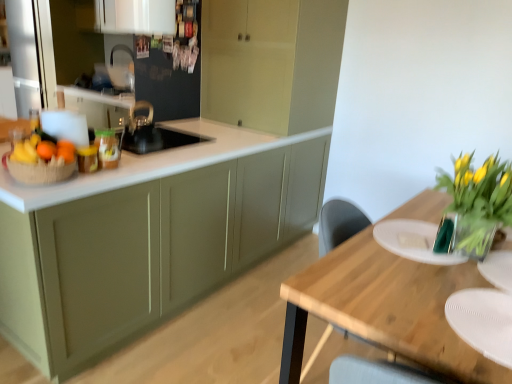
Locate an element on the screen. The image size is (512, 384). free location above brown woven basket at left (from a real-world perspective) is located at coordinates (38, 155).